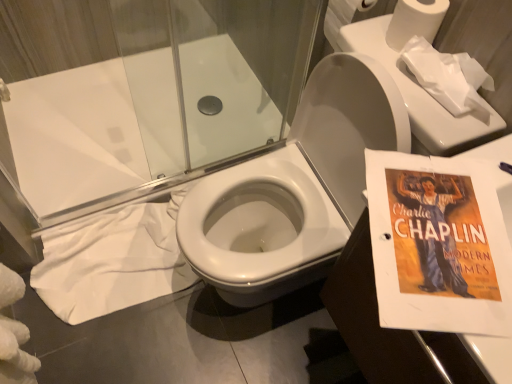
Question: Considering the relative sizes of matte paper charlie chaplin poster at right and white fabric at lower left in the image provided, is matte paper charlie chaplin poster at right smaller than white fabric at lower left?

Choices:
 (A) yes
 (B) no

Answer: (B)

Question: Does matte paper charlie chaplin poster at right have a lesser width compared to white fabric at lower left?

Choices:
 (A) no
 (B) yes

Answer: (A)

Question: Is matte paper charlie chaplin poster at right looking in the opposite direction of white fabric at lower left?

Choices:
 (A) no
 (B) yes

Answer: (A)

Question: From a real-world perspective, is matte paper charlie chaplin poster at right physically below white fabric at lower left?

Choices:
 (A) yes
 (B) no

Answer: (B)

Question: Does matte paper charlie chaplin poster at right lie behind white fabric at lower left?

Choices:
 (A) no
 (B) yes

Answer: (A)

Question: Looking at their shapes, would you say white paper at upper right, which is counted as the first toilet paper, starting from the back, is wider or thinner than white matte toilet paper at upper right, which is the 2th toilet paper from back to front?

Choices:
 (A) thin
 (B) wide

Answer: (A)

Question: Is white paper at upper right, which is counted as the third toilet paper, starting from the front, in front of or behind white matte toilet paper at upper right, which is the 2th toilet paper from back to front, in the image?

Choices:
 (A) behind
 (B) front

Answer: (A)

Question: In terms of height, does white paper at upper right, which is counted as the third toilet paper, starting from the front, look taller or shorter compared to white matte toilet paper at upper right, the second toilet paper viewed from the front?

Choices:
 (A) short
 (B) tall

Answer: (B)

Question: From a real-world perspective, is white paper at upper right, which is counted as the first toilet paper, starting from the back, above or below white matte toilet paper at upper right, which is the 2th toilet paper from back to front?

Choices:
 (A) above
 (B) below

Answer: (B)

Question: In terms of width, does matte paper charlie chaplin poster at right look wider or thinner when compared to transparent glass shower door at upper center?

Choices:
 (A) thin
 (B) wide

Answer: (B)

Question: Is point (439, 311) closer or farther from the camera than point (280, 79)?

Choices:
 (A) closer
 (B) farther

Answer: (A)

Question: Looking at the image, does matte paper charlie chaplin poster at right seem bigger or smaller compared to transparent glass shower door at upper center?

Choices:
 (A) big
 (B) small

Answer: (B)

Question: Do you think matte paper charlie chaplin poster at right is within transparent glass shower door at upper center, or outside of it?

Choices:
 (A) outside
 (B) inside

Answer: (A)

Question: Choose the correct answer: Is white matte toilet paper at upper right, which is the 2th toilet paper from back to front, inside transparent glass shower door at upper center or outside it?

Choices:
 (A) outside
 (B) inside

Answer: (A)

Question: Considering the positions of white matte toilet paper at upper right, the second toilet paper viewed from the front, and transparent glass shower door at upper center in the image, is white matte toilet paper at upper right, the second toilet paper viewed from the front, wider or thinner than transparent glass shower door at upper center?

Choices:
 (A) wide
 (B) thin

Answer: (A)